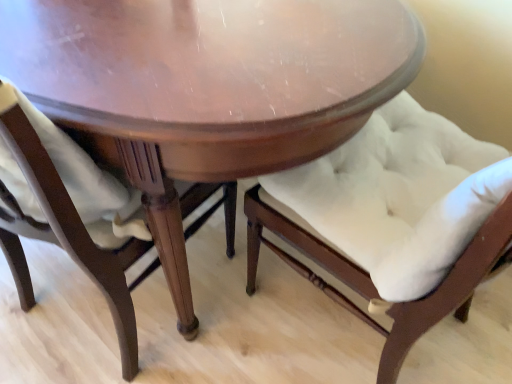
Question: From the image's perspective, is shiny wood table at center located beneath satin white cushion at lower left, the 2th chair viewed from the right?

Choices:
 (A) no
 (B) yes

Answer: (A)

Question: Can you confirm if shiny wood table at center is thinner than satin white cushion at lower left, the 2th chair viewed from the right?

Choices:
 (A) yes
 (B) no

Answer: (B)

Question: From the image's perspective, does shiny wood table at center appear higher than satin white cushion at lower left, which appears as the first chair when viewed from the left?

Choices:
 (A) no
 (B) yes

Answer: (B)

Question: Is shiny wood table at center aimed at satin white cushion at lower left, which appears as the first chair when viewed from the left?

Choices:
 (A) yes
 (B) no

Answer: (A)

Question: Is shiny wood table at center to the right of satin white cushion at lower left, which appears as the first chair when viewed from the left, from the viewer's perspective?

Choices:
 (A) no
 (B) yes

Answer: (A)

Question: Considering the relative sizes of shiny wood table at center and satin white cushion at lower left, the 2th chair viewed from the right, in the image provided, is shiny wood table at center smaller than satin white cushion at lower left, the 2th chair viewed from the right,?

Choices:
 (A) no
 (B) yes

Answer: (A)

Question: Does white tufted cushion at center, the 1th chair viewed from the right, have a smaller size compared to shiny wood table at center?

Choices:
 (A) no
 (B) yes

Answer: (B)

Question: Can you confirm if white tufted cushion at center, arranged as the second chair when viewed from the left, is bigger than shiny wood table at center?

Choices:
 (A) no
 (B) yes

Answer: (A)

Question: Does white tufted cushion at center, the 1th chair viewed from the right, have a lesser width compared to shiny wood table at center?

Choices:
 (A) no
 (B) yes

Answer: (B)

Question: Can you confirm if white tufted cushion at center, arranged as the second chair when viewed from the left, is shorter than shiny wood table at center?

Choices:
 (A) yes
 (B) no

Answer: (B)

Question: Considering the relative positions of white tufted cushion at center, arranged as the second chair when viewed from the left, and shiny wood table at center in the image provided, is white tufted cushion at center, arranged as the second chair when viewed from the left, behind shiny wood table at center?

Choices:
 (A) no
 (B) yes

Answer: (A)

Question: Is white tufted cushion at center, the 1th chair viewed from the right, to the left of shiny wood table at center from the viewer's perspective?

Choices:
 (A) no
 (B) yes

Answer: (A)

Question: Could you tell me if shiny wood table at center is facing white tufted cushion at center, arranged as the second chair when viewed from the left?

Choices:
 (A) no
 (B) yes

Answer: (A)